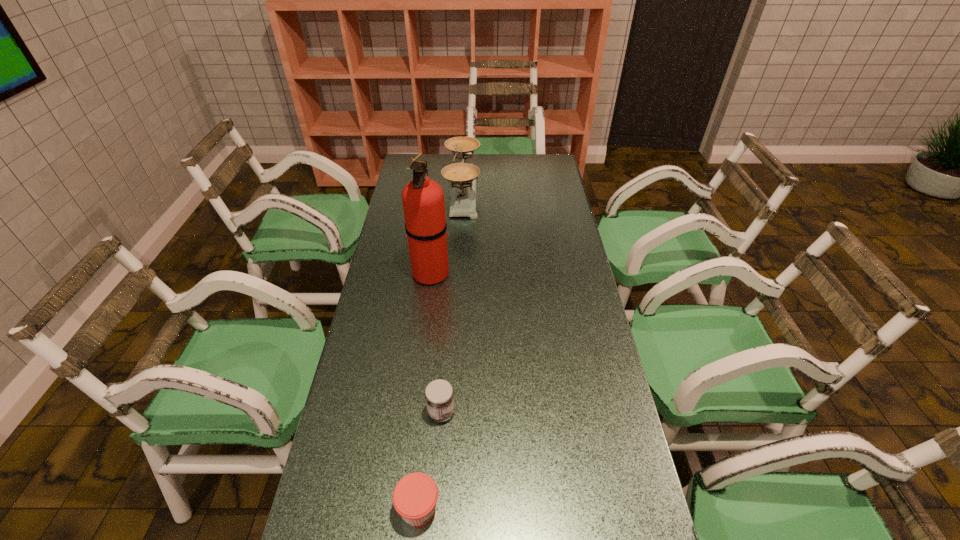
Find the location of `vacant space situated on the front label of the taller jam`. vacant space situated on the front label of the taller jam is located at coordinates (572, 413).

Find the location of a particular element. Image resolution: width=960 pixels, height=540 pixels. free space located on the front label of the nearest object is located at coordinates (583, 508).

You are a GUI agent. You are given a task and a screenshot of the screen. Output one action in this format:
    pyautogui.click(x=<x>, y=<y>)
    Task: Click on the object present at the far edge
    
    Given the screenshot: What is the action you would take?
    pyautogui.click(x=462, y=176)

Find the location of a particular element. object that is at the left edge is located at coordinates (423, 201).

Find the location of a particular element. Image resolution: width=960 pixels, height=540 pixels. blank space at the far edge is located at coordinates (443, 157).

I want to click on vacant space at the left edge of the desktop, so 390,294.

In the image, there is a desktop. At what (x,y) coordinates should I click in order to perform the action: click on free space at the right edge. Please return your answer as a coordinate pair (x, y). Image resolution: width=960 pixels, height=540 pixels. Looking at the image, I should click on (569, 221).

Image resolution: width=960 pixels, height=540 pixels. What are the coordinates of `free space at the far right corner` in the screenshot? It's located at (549, 156).

Locate an element on the screen. Image resolution: width=960 pixels, height=540 pixels. unoccupied position between the shorter jam and the tallest object is located at coordinates (424, 390).

You are a GUI agent. You are given a task and a screenshot of the screen. Output one action in this format:
    pyautogui.click(x=<x>, y=<y>)
    Task: Click on the free space between the nearest object and the farthest object
    Image resolution: width=960 pixels, height=540 pixels.
    Given the screenshot: What is the action you would take?
    pyautogui.click(x=441, y=351)